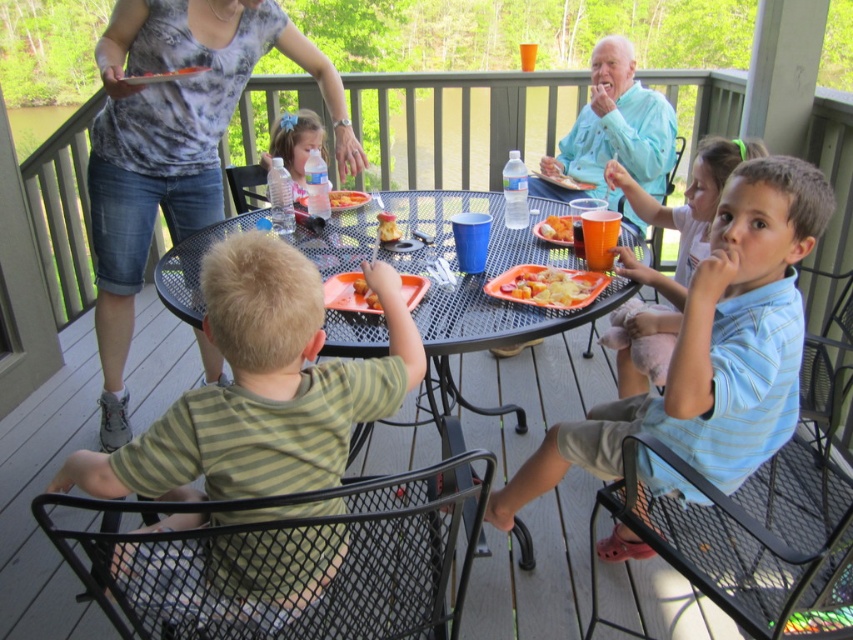
Question: Is green striped shirt at lower left closer to camera compared to yellowish matte pasta at center?

Choices:
 (A) yes
 (B) no

Answer: (A)

Question: Among these objects, which one is nearest to the camera?

Choices:
 (A) black mesh table at center
 (B) yellowish matte pasta at center

Answer: (A)

Question: Can you confirm if matte plastic water bottle at center is wider than smooth plastic fork at center?

Choices:
 (A) yes
 (B) no

Answer: (A)

Question: Is light blue striped shirt at right bigger than yellowish matte pasta at center?

Choices:
 (A) no
 (B) yes

Answer: (B)

Question: Which object is farther from the camera taking this photo?

Choices:
 (A) orange plastic plate at center
 (B) orange plastic cup at center

Answer: (B)

Question: Based on their relative distances, which object is farther from the orange plastic cup at center?

Choices:
 (A) light blue striped shirt at right
 (B) yellowish matte pasta at center
 (C) green striped shirt at lower left
 (D) orange plastic plate at center

Answer: (C)